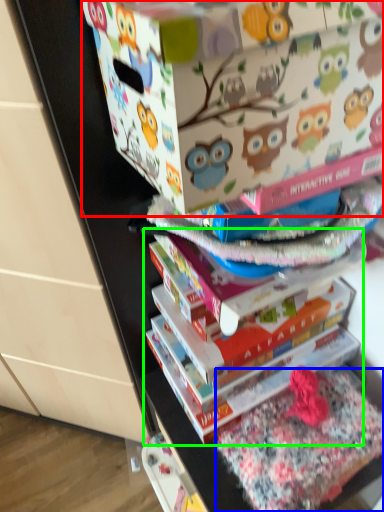
Question: Which is nearer to the cardboard box (highlighted by a red box)? fabric (highlighted by a blue box) or book (highlighted by a green box).

Choices:
 (A) fabric
 (B) book

Answer: (B)